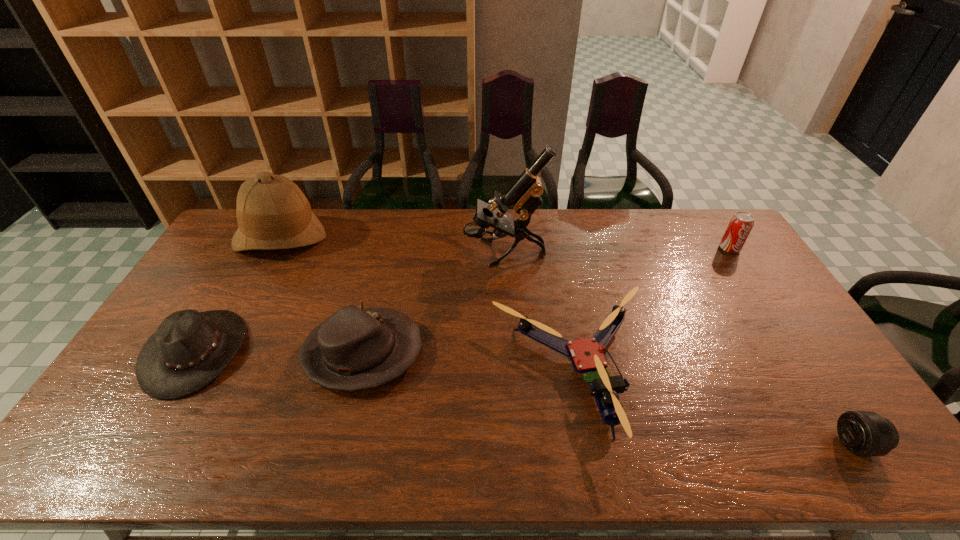
What are the coordinates of `drone located in the near edge section of the desktop` in the screenshot? It's located at (586, 355).

The width and height of the screenshot is (960, 540). What are the coordinates of `telephoto lens at the near edge` in the screenshot? It's located at pyautogui.click(x=864, y=433).

Where is `soda can positioned at the right edge`? soda can positioned at the right edge is located at coordinates (740, 225).

The width and height of the screenshot is (960, 540). In order to click on telephoto lens at the right edge in this screenshot , I will do `click(864, 433)`.

The width and height of the screenshot is (960, 540). Find the location of `object at the far left corner`. object at the far left corner is located at coordinates (272, 212).

Locate an element on the screen. Image resolution: width=960 pixels, height=540 pixels. object at the far right corner is located at coordinates (740, 225).

Find the location of `object located in the near right corner section of the desktop`. object located in the near right corner section of the desktop is located at coordinates (864, 433).

You are a GUI agent. You are given a task and a screenshot of the screen. Output one action in this format:
    pyautogui.click(x=<x>, y=<y>)
    Task: Click on the free space at the far edge
    
    Given the screenshot: What is the action you would take?
    pyautogui.click(x=387, y=245)

In the image, there is a desktop. Where is `free space at the near edge`? Image resolution: width=960 pixels, height=540 pixels. free space at the near edge is located at coordinates (168, 440).

Find the location of a particular element. free space at the left edge of the desktop is located at coordinates (197, 286).